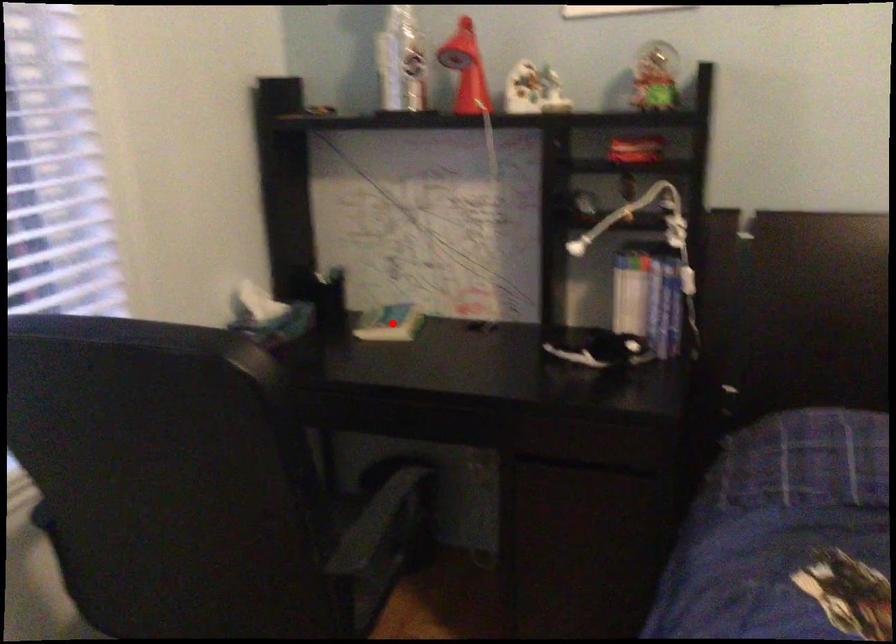
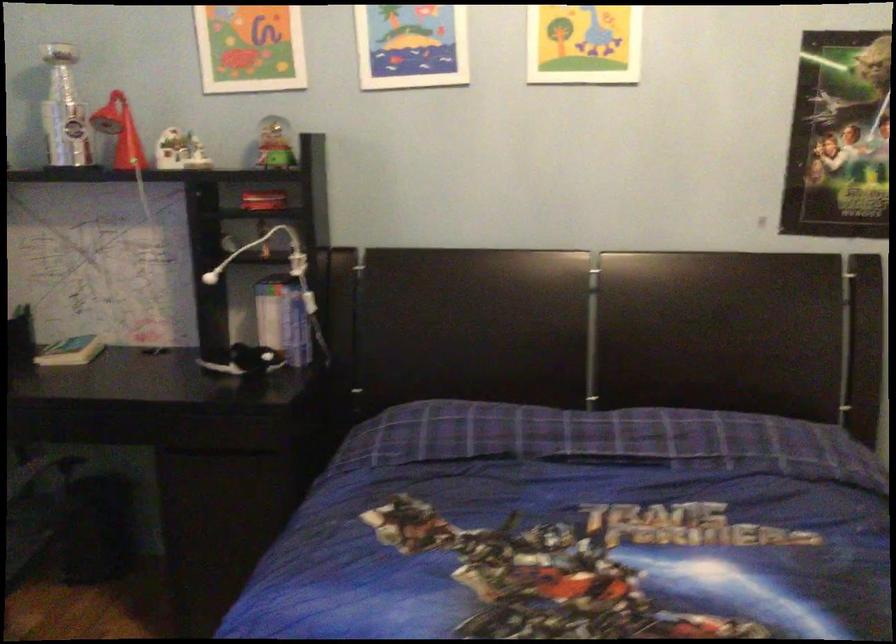
Question: I am providing you with two images of the same scene from different viewpoints. A red point is marked on the first image. Is the red point's position out of view in image 2?

Choices:
 (A) Yes
 (B) No

Answer: (B)